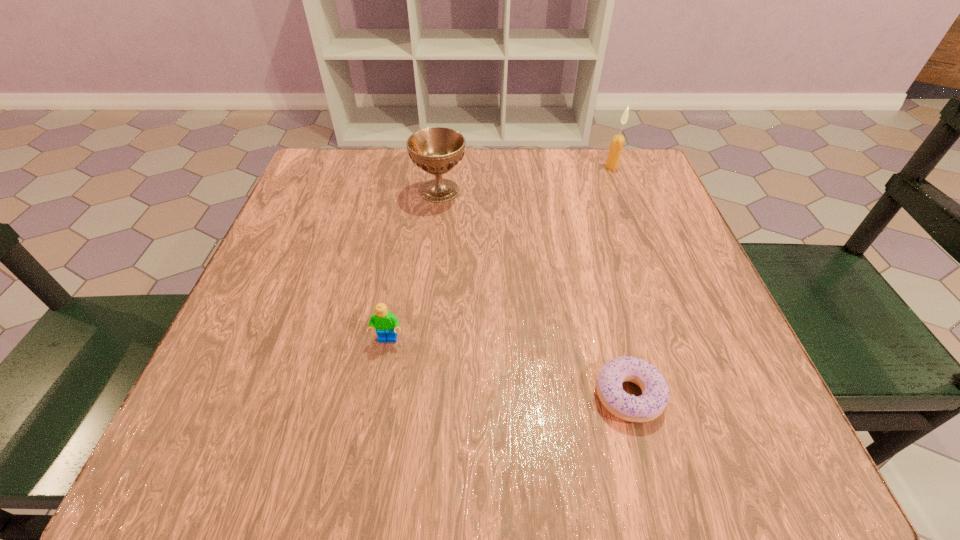
This screenshot has height=540, width=960. Find the location of `vacant space that is in between the shortest object and the second shortest object`. vacant space that is in between the shortest object and the second shortest object is located at coordinates (508, 367).

This screenshot has height=540, width=960. What are the coordinates of `vacant region between the doughnut and the rightmost object` in the screenshot? It's located at (620, 281).

This screenshot has width=960, height=540. Identify the location of free space between the farthest object and the third farthest object. (500, 253).

Find the location of `free space between the shortest object and the farthest object`. free space between the shortest object and the farthest object is located at coordinates pyautogui.click(x=620, y=281).

Identify the location of free area in between the Lego and the rightmost object. (500, 253).

Locate which object is the closest to the tallest object. Please provide its 2D coordinates. Your answer should be formatted as a tuple, i.e. [(x, y)], where the tuple contains the x and y coordinates of a point satisfying the conditions above.

[(436, 150)]

Identify which object is the third nearest to the second shortest object. Please provide its 2D coordinates. Your answer should be formatted as a tuple, i.e. [(x, y)], where the tuple contains the x and y coordinates of a point satisfying the conditions above.

[(616, 146)]

Locate an element on the screen. vacant region that satisfies the following two spatial constraints: 1. on the face of the second object from right to left; 2. on the right side of the third tallest object is located at coordinates (378, 395).

Locate an element on the screen. The width and height of the screenshot is (960, 540). free space that satisfies the following two spatial constraints: 1. on the back side of the candle; 2. on the left side of the doughnut is located at coordinates (569, 167).

The image size is (960, 540). In order to click on vacant space that satisfies the following two spatial constraints: 1. on the face of the shortest object; 2. on the left side of the Lego in this screenshot , I will do `click(378, 395)`.